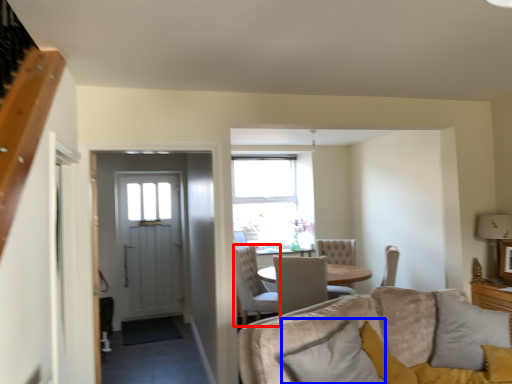
Question: Which object appears farthest to the camera in this image, chair (highlighted by a red box) or pillow (highlighted by a blue box)?

Choices:
 (A) chair
 (B) pillow

Answer: (A)